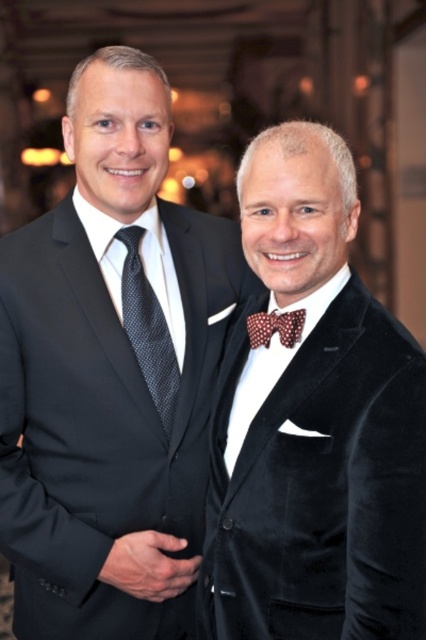
Is velvet bow tie at center above dark gray textured tie at left?

Incorrect, velvet bow tie at center is not positioned above dark gray textured tie at left.

Does velvet bow tie at center appear under dark gray textured tie at left?

Correct, velvet bow tie at center is located below dark gray textured tie at left.

Locate an element on the screen. Image resolution: width=426 pixels, height=640 pixels. velvet bow tie at center is located at coordinates (313, 424).

Is matte black suit at left closer to the viewer compared to dark gray textured tie at left?

Result: Yes, it is.

Does matte black suit at left have a lesser height compared to dark gray textured tie at left?

In fact, matte black suit at left may be taller than dark gray textured tie at left.

Which is in front, point (45, 296) or point (155, 404)?

Point (45, 296) is more forward.

Where is `matte black suit at left`? matte black suit at left is located at coordinates (111, 372).

Looking at this image, can you confirm if matte black suit at left is shorter than velvet bow tie at center?

No.

Which is below, matte black suit at left or velvet bow tie at center?

Positioned lower is velvet bow tie at center.

Where is `matte black suit at left`? The height and width of the screenshot is (640, 426). matte black suit at left is located at coordinates (111, 372).

I want to click on matte black suit at left, so click(111, 372).